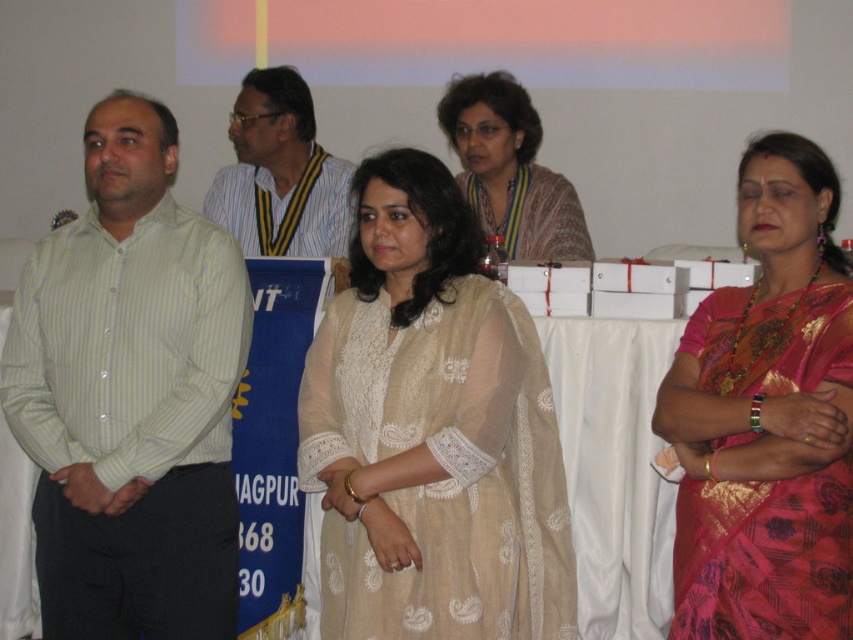
Question: Can you confirm if beige lace dress at center is wider than matte striped shirt at left?

Choices:
 (A) yes
 (B) no

Answer: (A)

Question: Which of the following is the closest to the observer?

Choices:
 (A) matte beige dress at center
 (B) silk saree at right

Answer: (B)

Question: Which of the following is the farthest from the observer?

Choices:
 (A) silk saree at right
 (B) green striped shirt at left
 (C) matte beige dress at center
 (D) matte striped shirt at left

Answer: (D)

Question: Is green striped shirt at left below matte striped shirt at left?

Choices:
 (A) yes
 (B) no

Answer: (A)

Question: Is beige lace dress at center to the left of matte striped shirt at left from the viewer's perspective?

Choices:
 (A) yes
 (B) no

Answer: (B)

Question: Which object is positioned farthest from the green striped shirt at left?

Choices:
 (A) matte striped shirt at left
 (B) matte beige dress at center

Answer: (B)